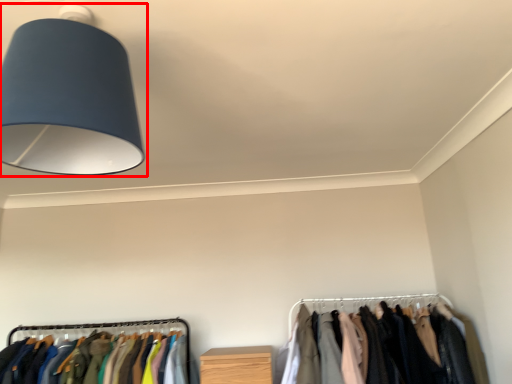
Question: From the image's perspective, where is lamp (annotated by the red box) located in relation to closet in the image?

Choices:
 (A) below
 (B) above

Answer: (B)